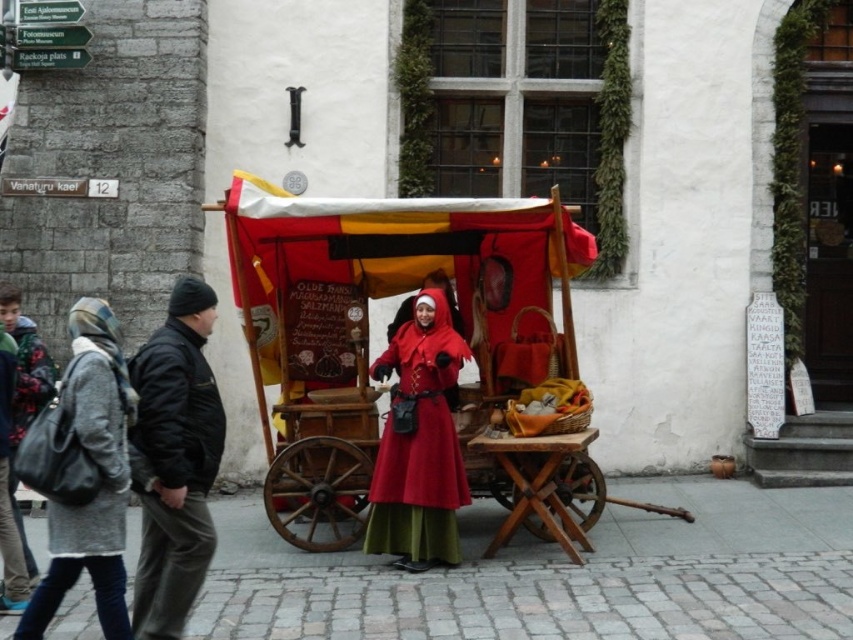
Question: In this image, where is gray woolen coat at lower left located relative to matte red coat at center?

Choices:
 (A) above
 (B) below

Answer: (B)

Question: From the image, what is the correct spatial relationship of black leather jacket at left in relation to matte red coat at center?

Choices:
 (A) below
 (B) above

Answer: (B)

Question: Does black leather jacket at left appear over matte red coat at center?

Choices:
 (A) yes
 (B) no

Answer: (A)

Question: Which point appears closest to the camera in this image?

Choices:
 (A) (80, 412)
 (B) (402, 380)
 (C) (805, 506)

Answer: (A)

Question: Estimate the real-world distances between objects in this image. Which object is farther from the gray woolen coat at lower left?

Choices:
 (A) black leather jacket at left
 (B) matte red coat at center
 (C) red fabric cart at center
 (D) cobblestone pavement at center

Answer: (C)

Question: Which point is farther from the camera taking this photo?

Choices:
 (A) (329, 604)
 (B) (386, 497)
 (C) (184, 452)
 (D) (71, 566)

Answer: (B)